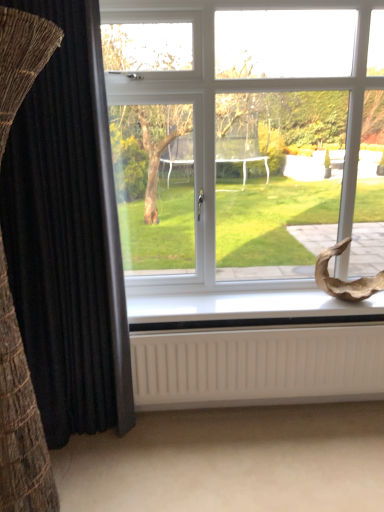
Locate an element on the screen. The width and height of the screenshot is (384, 512). vacant space situated above white matte radiator at bottom (from a real-world perspective) is located at coordinates (245, 327).